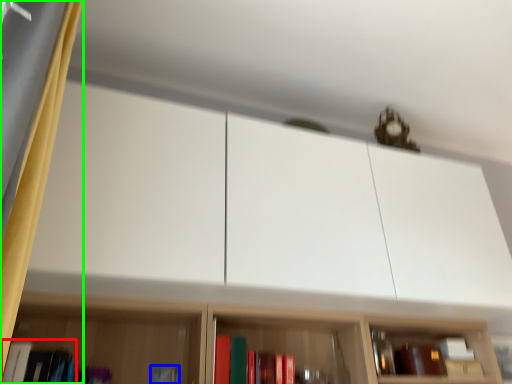
Question: Considering the real-world distances, which object is farthest from book (highlighted by a red box)? book (highlighted by a blue box) or curtain (highlighted by a green box)?

Choices:
 (A) book
 (B) curtain

Answer: (B)